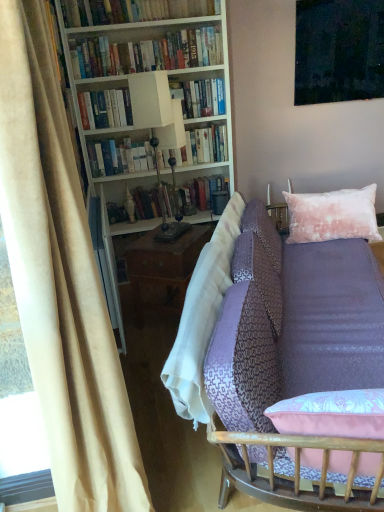
Question: Relative to metallic polished lamp at center, is hardcover books at upper left, which is the 1th book in top-to-bottom order, in front or behind?

Choices:
 (A) front
 (B) behind

Answer: (B)

Question: From the image's perspective, is hardcover books at upper left, which is the 1th book in top-to-bottom order, located above or below metallic polished lamp at center?

Choices:
 (A) below
 (B) above

Answer: (B)

Question: Estimate the real-world distances between objects in this image. Which object is farther from the white matte bookcase at upper left?

Choices:
 (A) hardcover books at upper center, marked as the second book in a bottom-to-top arrangement
 (B) metallic polished lamp at center
 (C) hardcover books at upper left, which is the 1th book in top-to-bottom order
 (D) beige velvet curtain at left
 (E) lavender fabric couch at center

Answer: (D)

Question: Which object is the closest to the lavender fabric couch at center?

Choices:
 (A) hardcover books at upper center, marked as the second book in a bottom-to-top arrangement
 (B) metallic polished lamp at center
 (C) velvet pink pillow at upper right
 (D) beige velvet curtain at left
 (E) hardcover books at upper left, which is the 1th book in top-to-bottom order

Answer: (C)